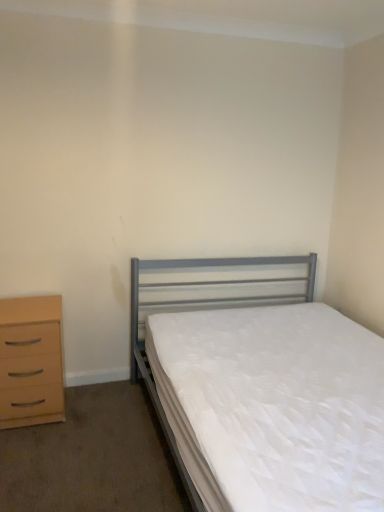
Question: Is light wood/texture chest of drawers at left shorter than metallic gray bed at center?

Choices:
 (A) yes
 (B) no

Answer: (A)

Question: From the image's perspective, is light wood/texture chest of drawers at left above metallic gray bed at center?

Choices:
 (A) no
 (B) yes

Answer: (A)

Question: Is light wood/texture chest of drawers at left with metallic gray bed at center?

Choices:
 (A) yes
 (B) no

Answer: (B)

Question: Considering the relative sizes of light wood/texture chest of drawers at left and metallic gray bed at center in the image provided, is light wood/texture chest of drawers at left bigger than metallic gray bed at center?

Choices:
 (A) no
 (B) yes

Answer: (A)

Question: Considering the relative sizes of light wood/texture chest of drawers at left and metallic gray bed at center in the image provided, is light wood/texture chest of drawers at left thinner than metallic gray bed at center?

Choices:
 (A) yes
 (B) no

Answer: (A)

Question: Can you confirm if light wood/texture chest of drawers at left is smaller than metallic gray bed at center?

Choices:
 (A) yes
 (B) no

Answer: (A)

Question: Does metallic gray bed at center lie in front of light wood/texture chest of drawers at left?

Choices:
 (A) yes
 (B) no

Answer: (A)

Question: From a real-world perspective, is metallic gray bed at center located higher than light wood/texture chest of drawers at left?

Choices:
 (A) no
 (B) yes

Answer: (B)

Question: Is metallic gray bed at center in contact with light wood/texture chest of drawers at left?

Choices:
 (A) yes
 (B) no

Answer: (B)

Question: Is metallic gray bed at center not near light wood/texture chest of drawers at left?

Choices:
 (A) no
 (B) yes

Answer: (A)

Question: Is metallic gray bed at center thinner than light wood/texture chest of drawers at left?

Choices:
 (A) no
 (B) yes

Answer: (A)

Question: Can you confirm if metallic gray bed at center is positioned to the right of light wood/texture chest of drawers at left?

Choices:
 (A) yes
 (B) no

Answer: (A)

Question: Is metallic gray bed at center wider or thinner than light wood/texture chest of drawers at left?

Choices:
 (A) wide
 (B) thin

Answer: (A)